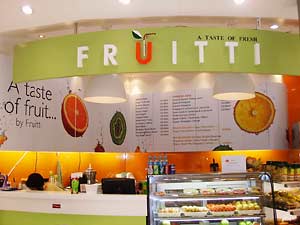
The width and height of the screenshot is (300, 225). I want to click on cash register, so click(118, 189).